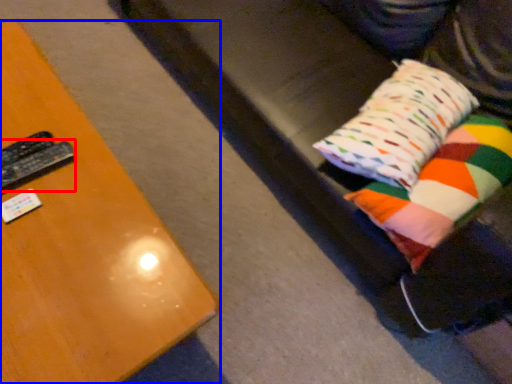
Question: Which object appears farthest to the camera in this image, remote (highlighted by a red box) or furniture (highlighted by a blue box)?

Choices:
 (A) remote
 (B) furniture

Answer: (A)